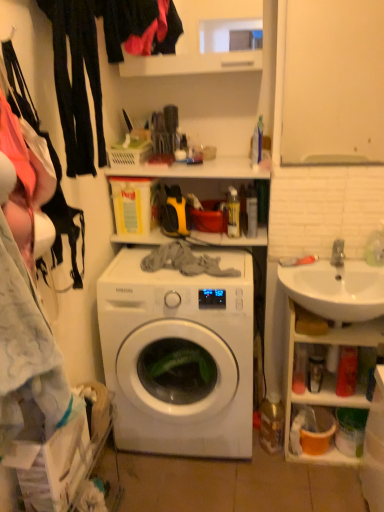
Question: Is matte black fabric at upper left taller than white glossy washing machine at center?

Choices:
 (A) yes
 (B) no

Answer: (B)

Question: Is matte black fabric at upper left shorter than white glossy washing machine at center?

Choices:
 (A) yes
 (B) no

Answer: (A)

Question: From the image's perspective, is matte black fabric at upper left located beneath white glossy washing machine at center?

Choices:
 (A) yes
 (B) no

Answer: (B)

Question: Is matte black fabric at upper left bigger than white glossy washing machine at center?

Choices:
 (A) no
 (B) yes

Answer: (A)

Question: From a real-world perspective, is matte black fabric at upper left over white glossy washing machine at center?

Choices:
 (A) no
 (B) yes

Answer: (B)

Question: Do you think matte black fabric at upper left is within white glossy washing machine at center, or outside of it?

Choices:
 (A) outside
 (B) inside

Answer: (A)

Question: From a real-world perspective, is matte black fabric at upper left positioned above or below white glossy washing machine at center?

Choices:
 (A) above
 (B) below

Answer: (A)

Question: In terms of size, does matte black fabric at upper left appear bigger or smaller than white glossy washing machine at center?

Choices:
 (A) small
 (B) big

Answer: (A)

Question: From the image's perspective, is matte black fabric at upper left located above or below white glossy washing machine at center?

Choices:
 (A) below
 (B) above

Answer: (B)

Question: In the image, is matte black fabric at upper left on the left side or the right side of white ceramic sink at right?

Choices:
 (A) left
 (B) right

Answer: (A)

Question: In terms of width, does matte black fabric at upper left look wider or thinner when compared to white ceramic sink at right?

Choices:
 (A) thin
 (B) wide

Answer: (A)

Question: From a real-world perspective, relative to white ceramic sink at right, is matte black fabric at upper left vertically above or below?

Choices:
 (A) below
 (B) above

Answer: (B)

Question: Considering their positions, is matte black fabric at upper left located in front of or behind white ceramic sink at right?

Choices:
 (A) behind
 (B) front

Answer: (B)

Question: From the image's perspective, is white glossy washing machine at center positioned above or below matte black fabric at upper left?

Choices:
 (A) above
 (B) below

Answer: (B)

Question: Is white glossy washing machine at center taller or shorter than matte black fabric at upper left?

Choices:
 (A) tall
 (B) short

Answer: (A)